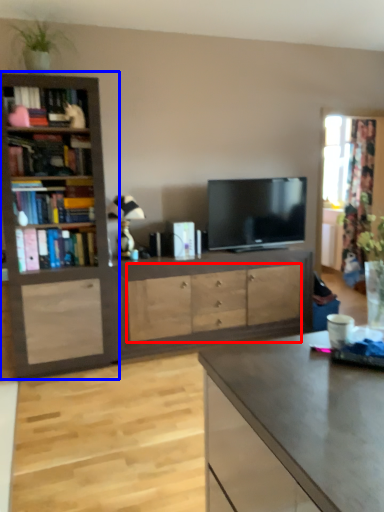
Question: Which of the following is the closest to the observer, drawer (highlighted by a red box) or bookcase (highlighted by a blue box)?

Choices:
 (A) drawer
 (B) bookcase

Answer: (B)